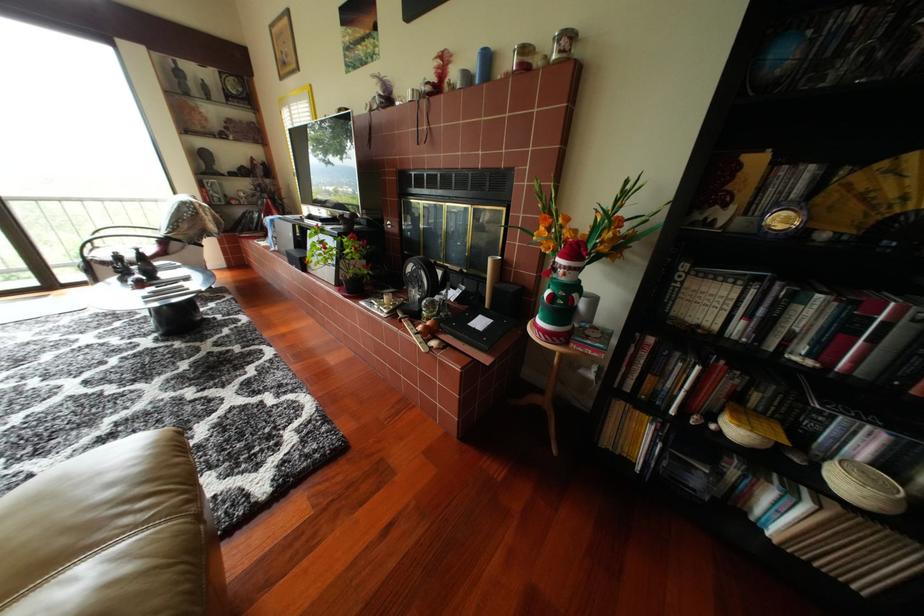
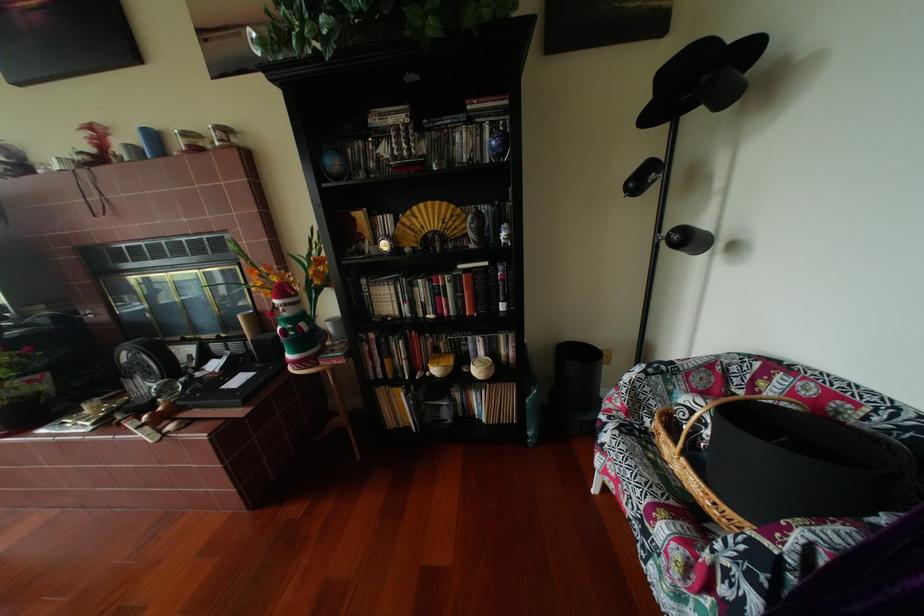
Find the pixel in the second image that matches pixel 810 461 in the first image.

(478, 371)